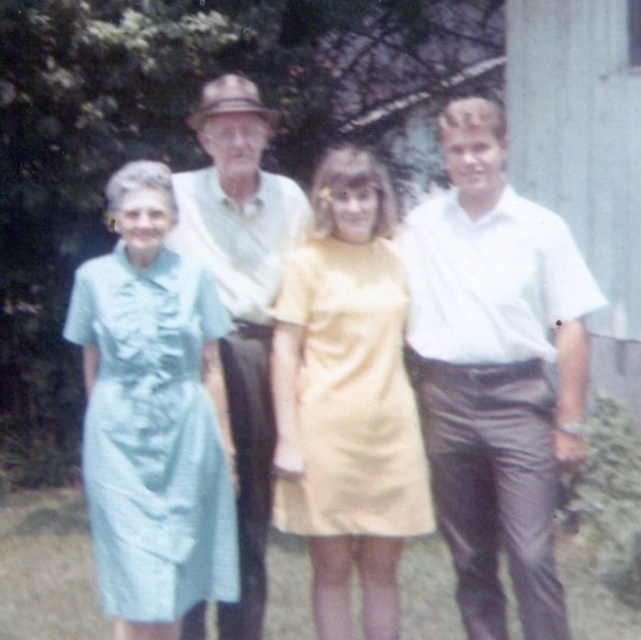
Between light blue fabric dress at left and light green fabric shirt at center, which one has less height?

With less height is light blue fabric dress at left.

At what (x,y) coordinates should I click in order to perform the action: click on light blue fabric dress at left. Please return your answer as a coordinate pair (x, y). Looking at the image, I should click on (153, 436).

Is light blue fabric dress at left to the right of yellow matte dress at center from the viewer's perspective?

Incorrect, light blue fabric dress at left is not on the right side of yellow matte dress at center.

Does point (124, 470) come closer to viewer compared to point (353, 260)?

Yes, it is.

Between point (188, 568) and point (303, 269), which one is positioned behind?

The point (303, 269) is behind.

Identify the location of light blue fabric dress at left. (153, 436).

Between white smooth shirt at right and yellow matte dress at center, which one appears on the right side from the viewer's perspective?

white smooth shirt at right

Does white smooth shirt at right have a smaller size compared to yellow matte dress at center?

Actually, white smooth shirt at right might be larger than yellow matte dress at center.

Find the location of `white smooth shirt at right`. white smooth shirt at right is located at coordinates (495, 371).

This screenshot has width=641, height=640. What are the coordinates of `white smooth shirt at right` in the screenshot? It's located at (495, 371).